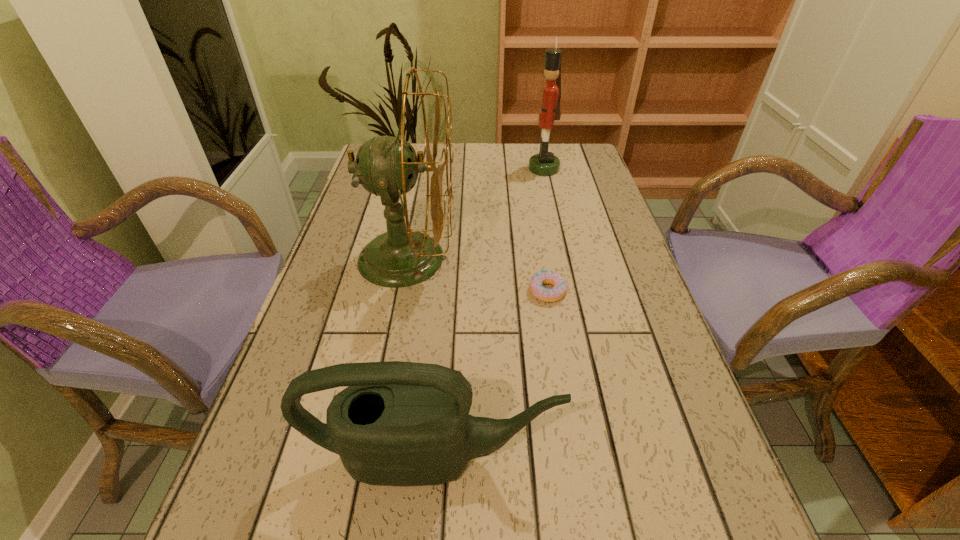
This screenshot has width=960, height=540. In order to click on object that is at the far edge in this screenshot , I will do `click(545, 163)`.

Where is `fan present at the left edge`? This screenshot has height=540, width=960. fan present at the left edge is located at coordinates (385, 166).

The image size is (960, 540). Find the location of `watering can that is at the left edge`. watering can that is at the left edge is located at coordinates (397, 423).

The height and width of the screenshot is (540, 960). What are the coordinates of `object that is at the right edge` in the screenshot? It's located at point(545,163).

Find the location of `object at the far right corner`. object at the far right corner is located at coordinates click(545, 163).

In the image, there is a desktop. Where is `vacant space at the far edge`? vacant space at the far edge is located at coordinates (519, 160).

The height and width of the screenshot is (540, 960). Find the location of `vacant space at the left edge of the desktop`. vacant space at the left edge of the desktop is located at coordinates (282, 497).

Where is `free space at the right edge of the desktop`? Image resolution: width=960 pixels, height=540 pixels. free space at the right edge of the desktop is located at coordinates (624, 407).

Find the location of a particular element. The width and height of the screenshot is (960, 540). empty location between the fan and the nutcracker is located at coordinates (475, 213).

You are a GUI agent. You are given a task and a screenshot of the screen. Output one action in this format:
    pyautogui.click(x=<x>, y=<y>)
    Task: Click on the empty location between the doughnut and the farthest object
    The image size is (960, 540).
    Given the screenshot: What is the action you would take?
    coord(546,230)